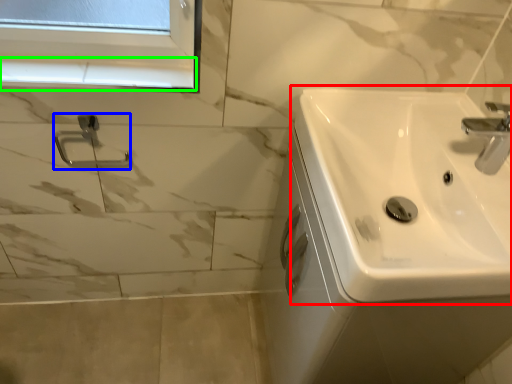
Question: Which object is the closest to the sink (highlighted by a red box)? Choose among these: shower (highlighted by a blue box) or window sill (highlighted by a green box).

Choices:
 (A) shower
 (B) window sill

Answer: (B)